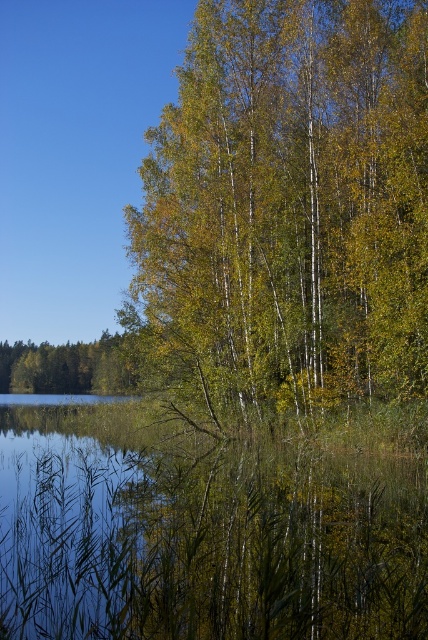
Question: Which point is farther to the camera?

Choices:
 (A) green leafy tree at left
 (B) green matte tree at center

Answer: (A)

Question: Which point appears farthest from the camera in this image?

Choices:
 (A) (56, 371)
 (B) (97, 513)

Answer: (A)

Question: Is transparent water at lower left positioned before green leafy tree at left?

Choices:
 (A) no
 (B) yes

Answer: (B)

Question: Which object is the closest to the green leafy tree at left?

Choices:
 (A) transparent water at lower left
 (B) green matte tree at center

Answer: (A)

Question: Where is transparent water at lower left located in relation to green leafy tree at left in the image?

Choices:
 (A) left
 (B) right

Answer: (B)

Question: Is transparent water at lower left positioned at the back of green leafy tree at left?

Choices:
 (A) no
 (B) yes

Answer: (A)